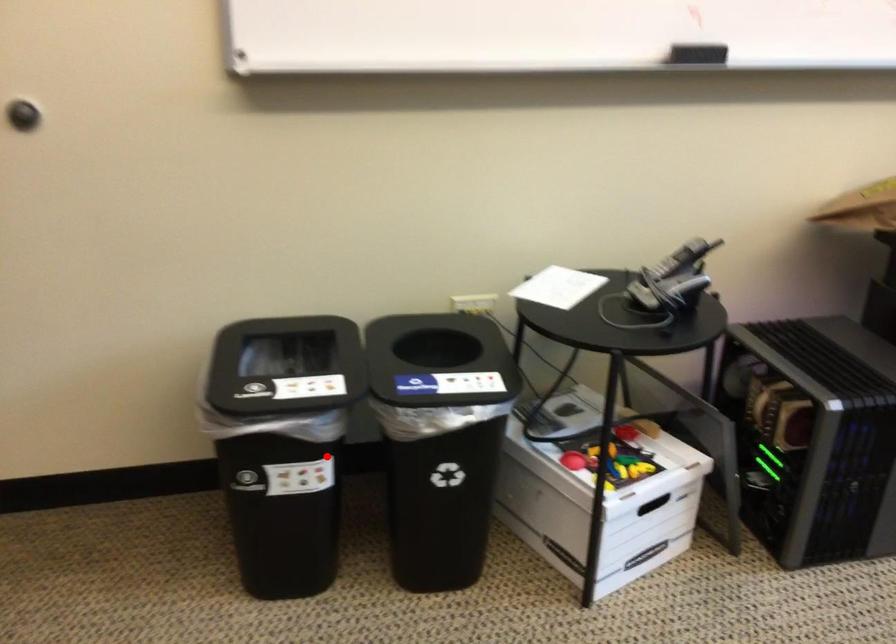
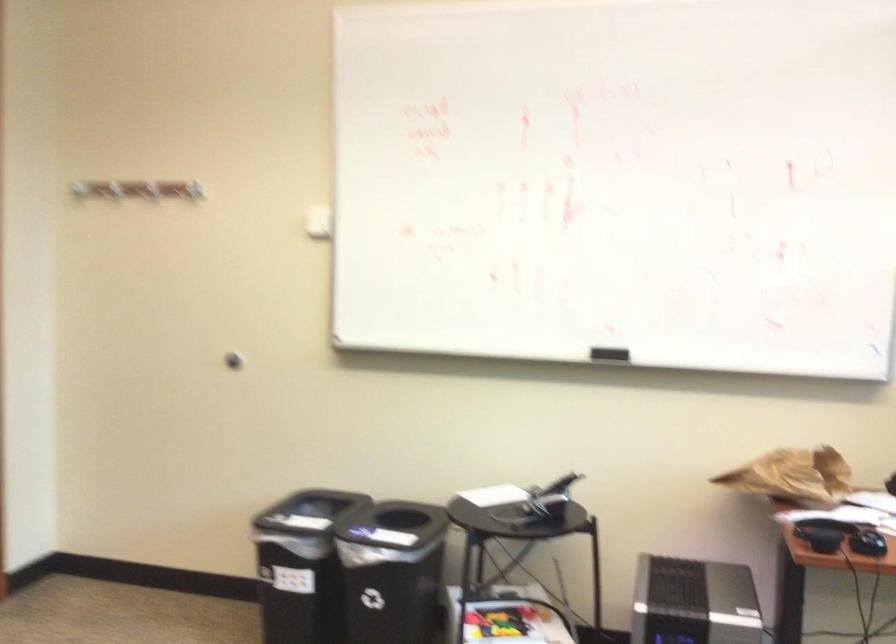
Question: A red point is marked in image1. In image2, is the corresponding 3D point closer to the camera or farther? Reply with the corresponding letter.

Choices:
 (A) The corresponding 3D point is closer.
 (B) The corresponding 3D point is farther.

Answer: (B)